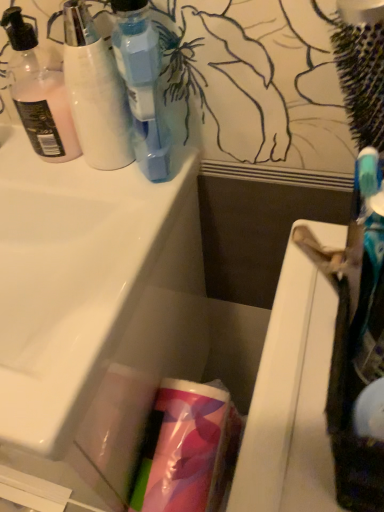
Locate an element on the screen. The width and height of the screenshot is (384, 512). free spot in front of translucent plastic bottle at upper left, the 2th bottle positioned from the left is located at coordinates (113, 222).